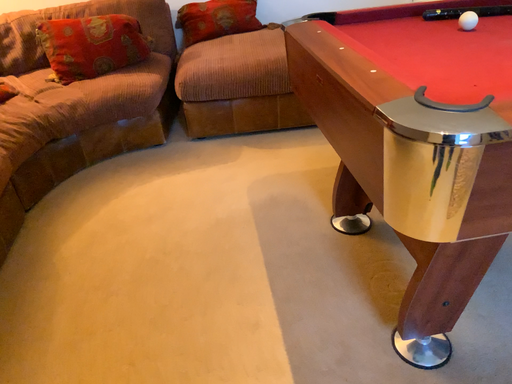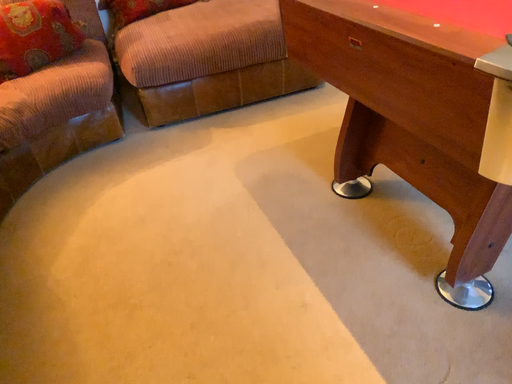
Question: Which way did the camera rotate in the video?

Choices:
 (A) rotated left
 (B) rotated right

Answer: (B)